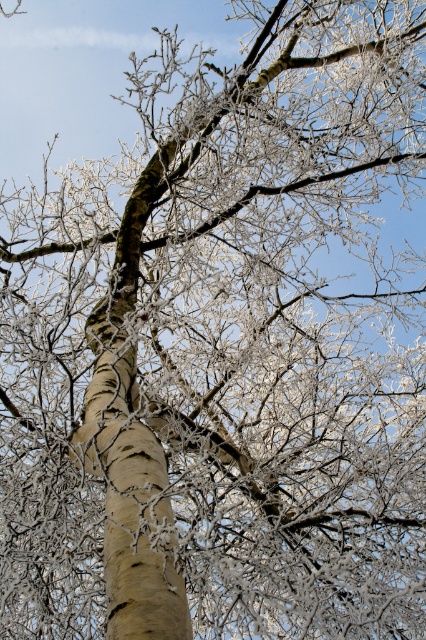
You are a photographer standing 10 meters away from a frosted bark branch at center in a winter scene. You want to capture a closeup shot of the branch. How much closer should you move to ensure the branch fills the frame adequately?

To capture a closeup shot of the frosted bark branch at center, you should move approximately 1.97 meters closer, positioning yourself at a distance of about 6.06 meters from the branch. This adjustment ensures the branch fills the frame appropriately while maintaining clarity.

You are an artist trying to capture the winter scene. You notice two branches at the center of the tree. Which one is larger in size between the frosted bark branch at center and the smooth beige bark at center?

The frosted bark branch at center is bigger than the smooth beige bark at center.

You are standing in front of the frosty tree scene. You want to know how far the point at coordinates point (3,115) is from your current position. Can you determine the distance?

The distance of point (3,115) from the camera is 29.26 feet, so the point is 29.26 feet away from your current position.